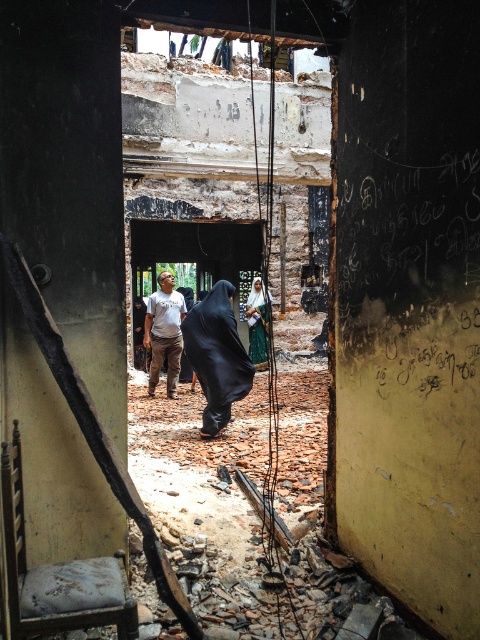
Question: Based on their relative distances, which object is farther from the light brown cotton shirt at center?

Choices:
 (A) green fabric dress at center
 (B) black matte/velvet robe at center

Answer: (A)

Question: Is black matte/velvet robe at center behind light brown cotton shirt at center?

Choices:
 (A) yes
 (B) no

Answer: (B)

Question: Which of the following is the farthest from the observer?

Choices:
 (A) (216, 397)
 (B) (176, 310)
 (C) (250, 332)

Answer: (C)

Question: Is light brown cotton shirt at center thinner than green fabric dress at center?

Choices:
 (A) no
 (B) yes

Answer: (A)

Question: Which point is farther from the camera taking this photo?

Choices:
 (A) (267, 358)
 (B) (167, 380)

Answer: (A)

Question: Can you confirm if black matte/velvet robe at center is bigger than green fabric dress at center?

Choices:
 (A) yes
 (B) no

Answer: (B)